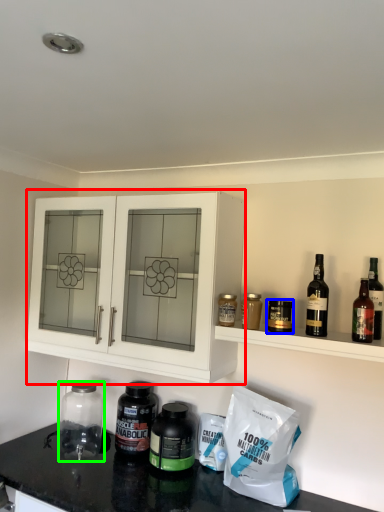
Question: Based on their relative distances, which object is farther from cabinetry (highlighted by a red box)? Choose from bottle (highlighted by a blue box) and glass jar (highlighted by a green box).

Choices:
 (A) bottle
 (B) glass jar

Answer: (A)